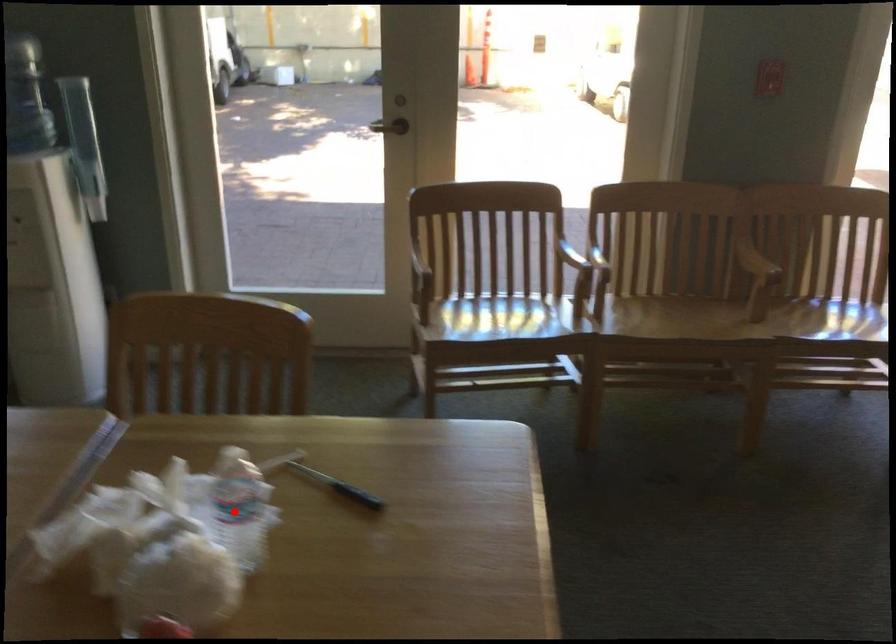
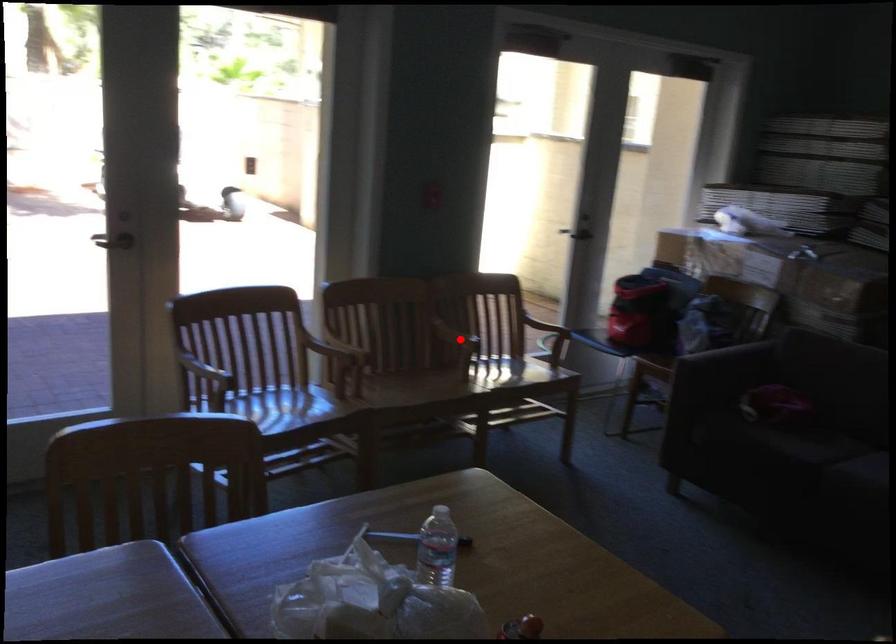
I am providing you with two images of the same scene from different viewpoints. A red point is marked on the first image and another point is marked on the second image. Is the red point in image1 aligned with the point shown in image2?

No